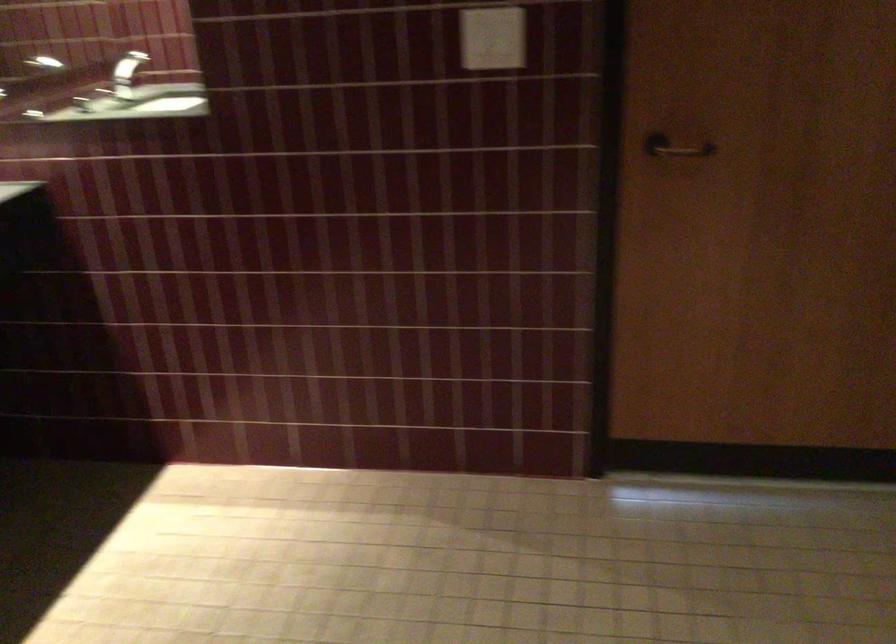
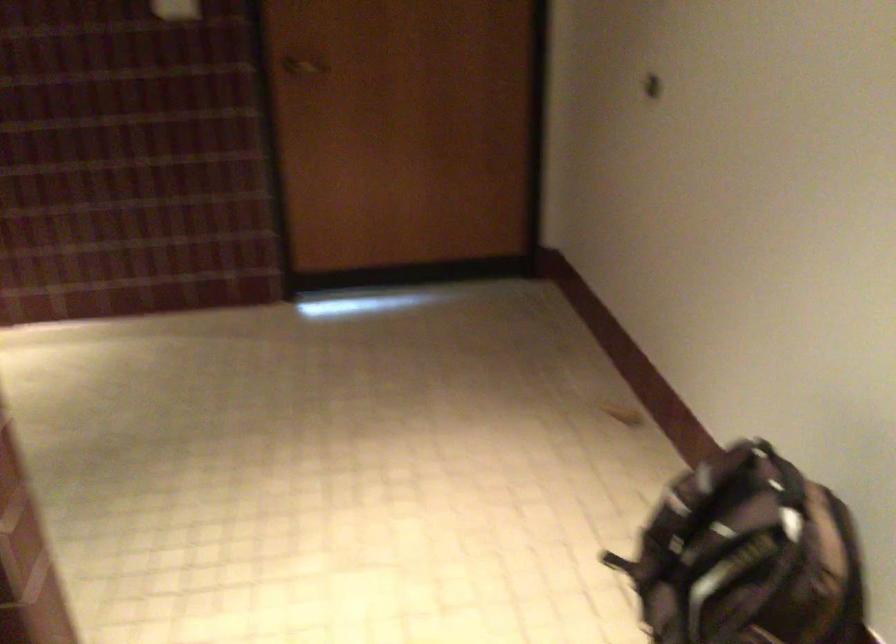
Question: The images are taken continuously from a first-person perspective. In which direction are you moving?

Choices:
 (A) Left
 (B) Right
 (C) Forward
 (D) Backward

Answer: (D)